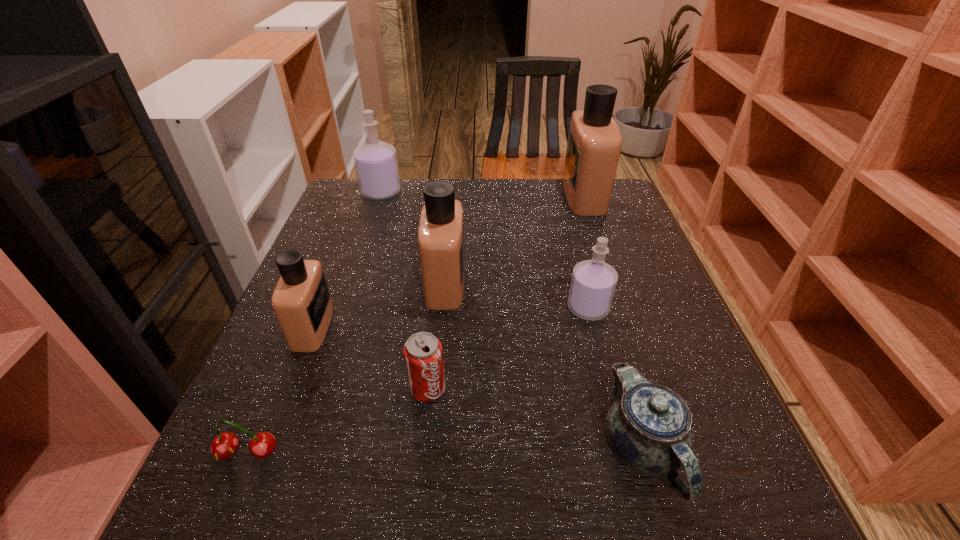
At what (x,y) coordinates should I click in order to perform the action: click on vacant area that lies between the nearer purple perfume and the third perfume from right to left. Please return your answer as a coordinate pair (x, y). This screenshot has height=540, width=960. Looking at the image, I should click on (516, 295).

I want to click on free space between the red cherry and the tallest object, so click(416, 325).

Point out which object is positioned as the second nearest to the chinaware. Please provide its 2D coordinates. Your answer should be formatted as a tuple, i.e. [(x, y)], where the tuple contains the x and y coordinates of a point satisfying the conditions above.

[(423, 355)]

Find the location of `object that is the fifth closest to the rightmost beige perfume`. object that is the fifth closest to the rightmost beige perfume is located at coordinates (423, 355).

What are the coordinates of `perfume that stands as the second closest to the tallest perfume` in the screenshot? It's located at (441, 226).

Identify the location of perfume that stands as the fourth closest to the left purple perfume. (593, 283).

This screenshot has height=540, width=960. I want to click on the closest beige perfume relative to the second beige perfume from left to right, so click(301, 300).

The height and width of the screenshot is (540, 960). What are the coordinates of `the closest beige perfume relative to the farthest beige perfume` in the screenshot? It's located at (441, 226).

The height and width of the screenshot is (540, 960). I want to click on vacant region that satisfies the following two spatial constraints: 1. on the front label of the second beige perfume from left to right; 2. with stems pointing upwards on the shortest object, so [430, 453].

This screenshot has width=960, height=540. I want to click on vacant area in the image that satisfies the following two spatial constraints: 1. on the front side of the left purple perfume; 2. on the right side of the soda can, so click(x=316, y=389).